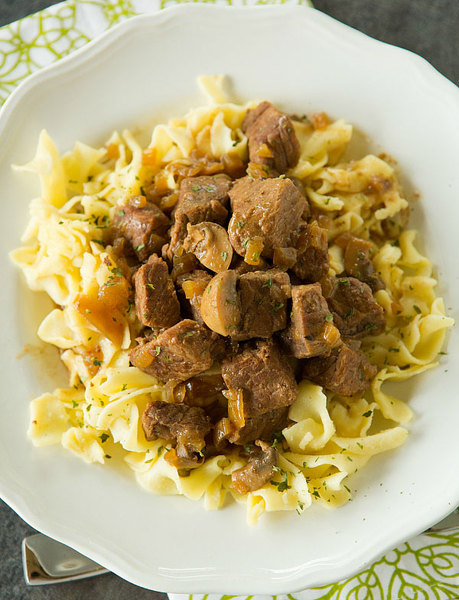
Where is `white scalloped bowl`? white scalloped bowl is located at coordinates (155, 553).